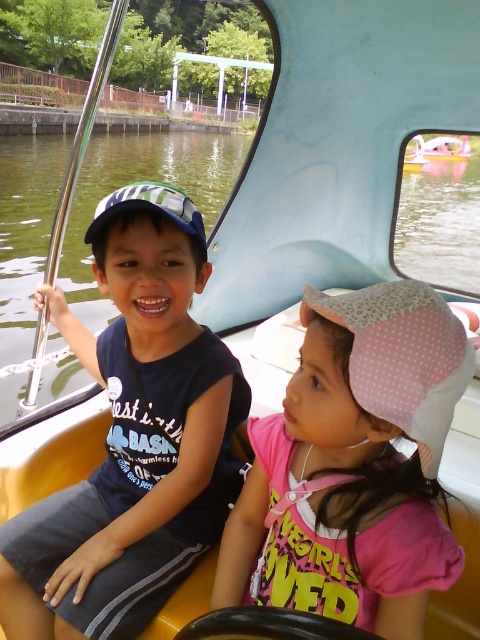
You are a photographer trying to capture a clear shot of the pink dotted fabric hat at center and the pink fabric boat at center. Based on their positions, which object should you focus on first to ensure both are in frame?

The pink dotted fabric hat at center is located below the pink fabric boat at center, so you should focus on the pink fabric boat at center first to ensure both are in frame.

You are a photographer trying to capture a photo of the matte black shirt at center and the pink fabric boat at center. Which object should you focus on first if you want to ensure both are in focus without adjusting your camera settings?

The matte black shirt at center has a lesser height compared to the pink fabric boat at center, so you should focus on the pink fabric boat at center first since it is taller and will require a closer focus point.